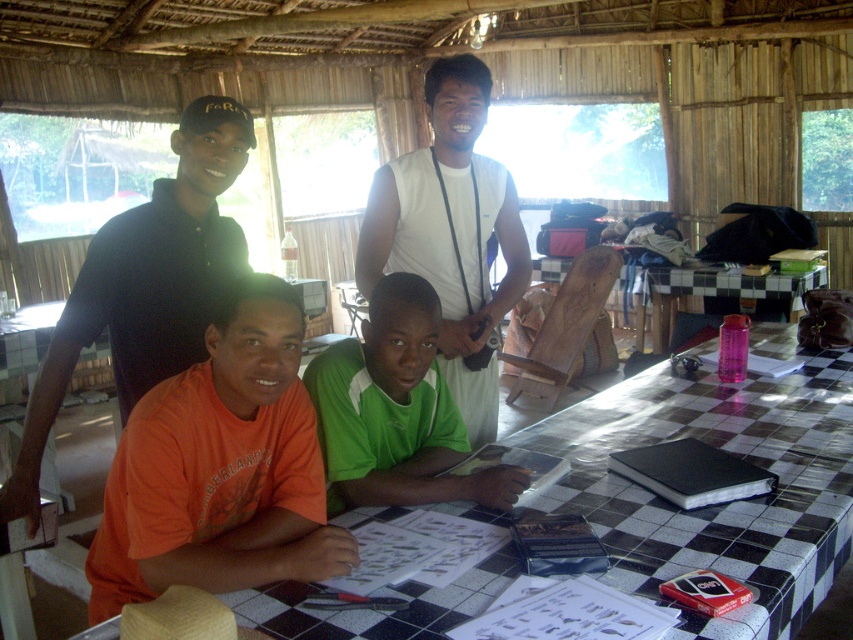
Is matte black polo shirt at upper left bigger than white matte shirt at upper center?

No, matte black polo shirt at upper left is not bigger than white matte shirt at upper center.

Measure the distance between point (102, 307) and camera.

Point (102, 307) is 1.88 meters from camera.

Locate an element on the screen. matte black polo shirt at upper left is located at coordinates (144, 284).

I want to click on matte black polo shirt at upper left, so click(144, 284).

Which is behind, point (520, 440) or point (421, 285)?

The point (520, 440) is behind.

From the picture: Who is positioned more to the right, checkerboard-patterned table at center or green jersey at center?

checkerboard-patterned table at center

Between point (834, 385) and point (424, 326), which one is positioned behind?

Point (834, 385)

Locate an element on the screen. checkerboard-patterned table at center is located at coordinates (727, 502).

Which is behind, point (468, 435) or point (444, 381)?

The point (468, 435) is behind.

Based on the photo, does white matte shirt at upper center come in front of green jersey at center?

That is False.

This screenshot has height=640, width=853. I want to click on white matte shirt at upper center, so click(451, 234).

Locate an element on the screen. The width and height of the screenshot is (853, 640). white matte shirt at upper center is located at coordinates (451, 234).